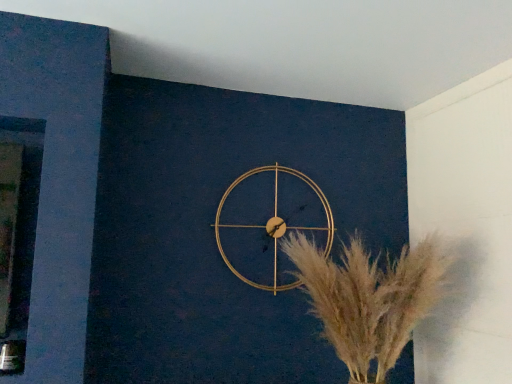
The height and width of the screenshot is (384, 512). What do you see at coordinates (274, 224) in the screenshot? I see `gold metallic wall clock at center` at bounding box center [274, 224].

Identify the location of gold metallic wall clock at center. The width and height of the screenshot is (512, 384). (274, 224).

You are a GUI agent. You are given a task and a screenshot of the screen. Output one action in this format:
    pyautogui.click(x=<x>, y=<y>)
    Task: Click on the silvery metallic pampas grass at center
    
    Given the screenshot: What is the action you would take?
    pyautogui.click(x=369, y=298)

Consider the image. Measure the distance between silvery metallic pampas grass at center and camera.

They are 5.23 feet apart.

This screenshot has height=384, width=512. What do you see at coordinates (369, 298) in the screenshot? I see `silvery metallic pampas grass at center` at bounding box center [369, 298].

The height and width of the screenshot is (384, 512). I want to click on gold metallic wall clock at center, so click(274, 224).

Considering the relative positions of gold metallic wall clock at center and silvery metallic pampas grass at center in the image provided, is gold metallic wall clock at center to the left of silvery metallic pampas grass at center from the viewer's perspective?

Indeed, gold metallic wall clock at center is positioned on the left side of silvery metallic pampas grass at center.

Is gold metallic wall clock at center further to the viewer compared to silvery metallic pampas grass at center?

That is True.

Between point (262, 166) and point (366, 298), which one is positioned behind?

Positioned behind is point (262, 166).

From the image's perspective, is gold metallic wall clock at center located above or below silvery metallic pampas grass at center?

gold metallic wall clock at center is situated higher than silvery metallic pampas grass at center in the image.

From a real-world perspective, between gold metallic wall clock at center and silvery metallic pampas grass at center, who is vertically lower?

silvery metallic pampas grass at center is physically lower.

Can you confirm if gold metallic wall clock at center is wider than silvery metallic pampas grass at center?

In fact, gold metallic wall clock at center might be narrower than silvery metallic pampas grass at center.

Based on the photo, considering the sizes of gold metallic wall clock at center and silvery metallic pampas grass at center in the image, is gold metallic wall clock at center taller or shorter than silvery metallic pampas grass at center?

Considering their sizes, gold metallic wall clock at center has less height than silvery metallic pampas grass at center.

In the scene shown: Between gold metallic wall clock at center and silvery metallic pampas grass at center, which one has larger size?

Bigger between the two is silvery metallic pampas grass at center.

Do you think gold metallic wall clock at center is within silvery metallic pampas grass at center, or outside of it?

gold metallic wall clock at center is not enclosed by silvery metallic pampas grass at center.

Are gold metallic wall clock at center and silvery metallic pampas grass at center located far from each other?

No.

Does gold metallic wall clock at center turn towards silvery metallic pampas grass at center?

Yes, gold metallic wall clock at center is oriented towards silvery metallic pampas grass at center.

How many degrees apart are the facing directions of gold metallic wall clock at center and silvery metallic pampas grass at center?

1.34 degrees separate the facing orientations of gold metallic wall clock at center and silvery metallic pampas grass at center.

Image resolution: width=512 pixels, height=384 pixels. I want to click on flower on the right of gold metallic wall clock at center, so click(369, 298).

Based on the photo, considering the relative positions of silvery metallic pampas grass at center and gold metallic wall clock at center in the image provided, is silvery metallic pampas grass at center to the left of gold metallic wall clock at center from the viewer's perspective?

No.

Is silvery metallic pampas grass at center further to camera compared to gold metallic wall clock at center?

No, the depth of silvery metallic pampas grass at center is less than that of gold metallic wall clock at center.

Between point (378, 330) and point (274, 263), which one is positioned in front?

Point (378, 330)

From the image's perspective, is silvery metallic pampas grass at center under gold metallic wall clock at center?

Yes, from the image's perspective, silvery metallic pampas grass at center is beneath gold metallic wall clock at center.

From a real-world perspective, which is physically below, silvery metallic pampas grass at center or gold metallic wall clock at center?

silvery metallic pampas grass at center, from a real-world perspective.

From the picture: Considering the sizes of silvery metallic pampas grass at center and gold metallic wall clock at center in the image, is silvery metallic pampas grass at center wider or thinner than gold metallic wall clock at center?

Considering their sizes, silvery metallic pampas grass at center looks broader than gold metallic wall clock at center.

Who is taller, silvery metallic pampas grass at center or gold metallic wall clock at center?

silvery metallic pampas grass at center.

Is silvery metallic pampas grass at center bigger or smaller than gold metallic wall clock at center?

Considering their sizes, silvery metallic pampas grass at center takes up more space than gold metallic wall clock at center.

Is silvery metallic pampas grass at center not within gold metallic wall clock at center?

Yes, silvery metallic pampas grass at center is outside of gold metallic wall clock at center.

Is the surface of silvery metallic pampas grass at center in direct contact with gold metallic wall clock at center?

silvery metallic pampas grass at center is not next to gold metallic wall clock at center, and they're not touching.

Could you tell me if silvery metallic pampas grass at center is facing gold metallic wall clock at center?

No, silvery metallic pampas grass at center is not turned towards gold metallic wall clock at center.

From the picture: How much distance is there between silvery metallic pampas grass at center and gold metallic wall clock at center?

A distance of 14.78 inches exists between silvery metallic pampas grass at center and gold metallic wall clock at center.

Where is `wall clock lying above the silvery metallic pampas grass at center (from the image's perspective)`? The height and width of the screenshot is (384, 512). wall clock lying above the silvery metallic pampas grass at center (from the image's perspective) is located at coordinates (274, 224).

The image size is (512, 384). Find the location of `flower that is under the gold metallic wall clock at center (from a real-world perspective)`. flower that is under the gold metallic wall clock at center (from a real-world perspective) is located at coordinates (369, 298).

At what (x,y) coordinates should I click in order to perform the action: click on wall clock above the silvery metallic pampas grass at center (from a real-world perspective). Please return your answer as a coordinate pair (x, y). Looking at the image, I should click on (274, 224).